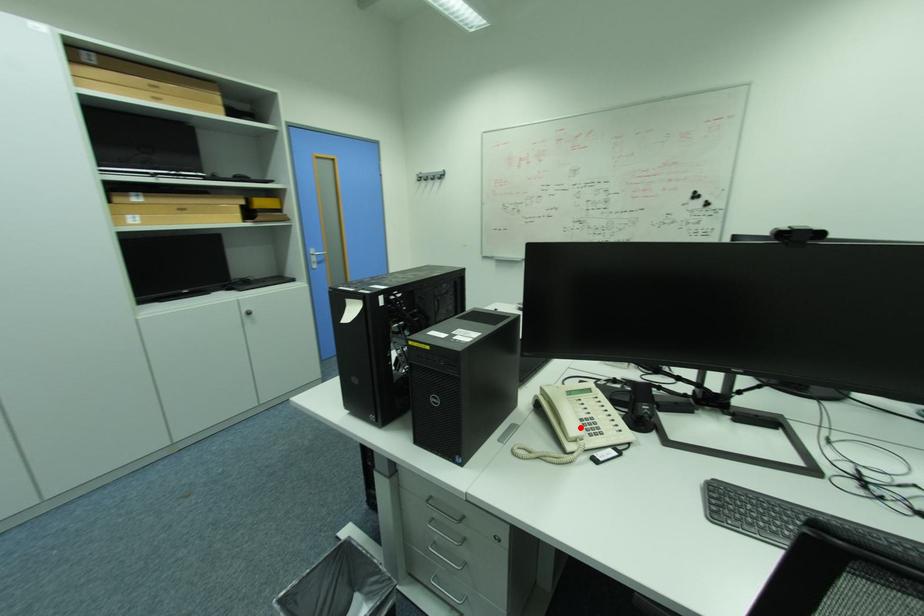
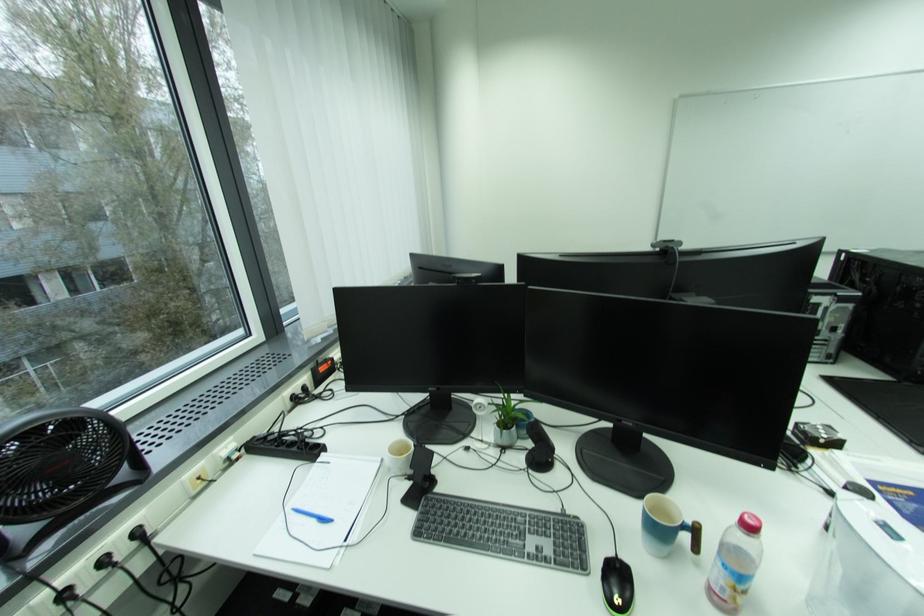
Question: I am providing you with two images of the same scene from different viewpoints. A red point is marked on the first image. At the location where the point appears in image 1, is it still visible in image 2?

Choices:
 (A) Yes
 (B) No

Answer: (B)